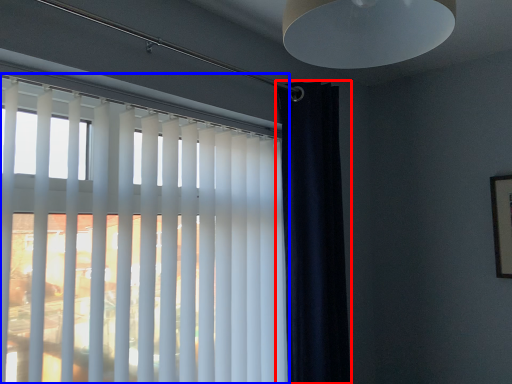
Question: Which of the following is the farthest to the observer, curtain (highlighted by a red box) or window blind (highlighted by a blue box)?

Choices:
 (A) curtain
 (B) window blind

Answer: (A)